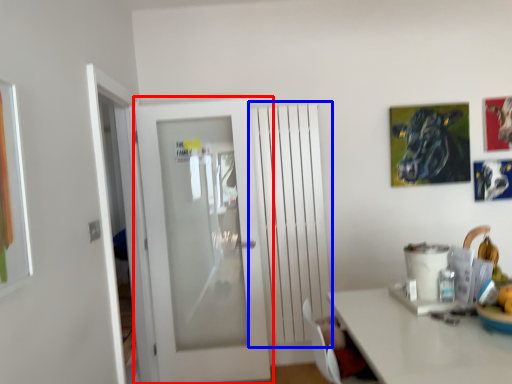
Question: Which point is further to the camera, door (highlighted by a red box) or radiator (highlighted by a blue box)?

Choices:
 (A) door
 (B) radiator

Answer: (B)